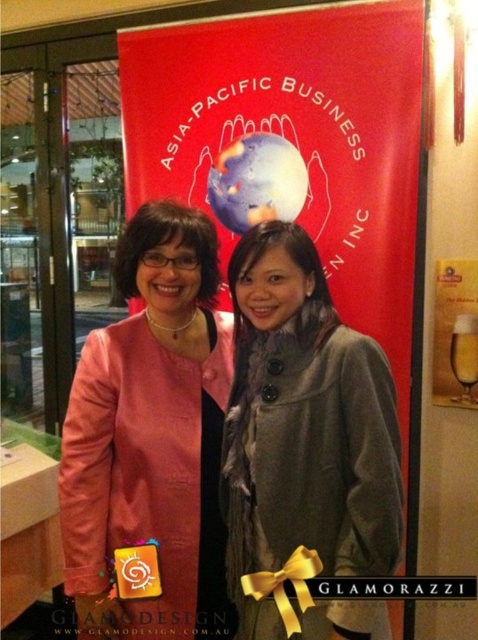
You are a photographer setting up for a group photo. You see the red fabric banner at center and the gray wool coat at center. Which object is positioned higher in the image?

The red fabric banner at center is positioned higher than the gray wool coat at center in the image.

You are standing in the conference room and want to move from the point at coordinates point (326,93) to the point at coordinates point (158,445). Is the destination point in front of or behind you?

The point at coordinates point (158,445) is in front of you because the point at coordinates point (326,93) is behind it.

You are organizing a photoshoot and need to arrange two coats for a fashion spread. The pink leather jacket at center and the gray wool coat at center must be placed in the same position as in the original image. If you want to place a third coat between them, where should you position it?

Since the pink leather jacket at center is to the left of the gray wool coat at center, you should place the third coat between them, maintaining their original left and right positions.